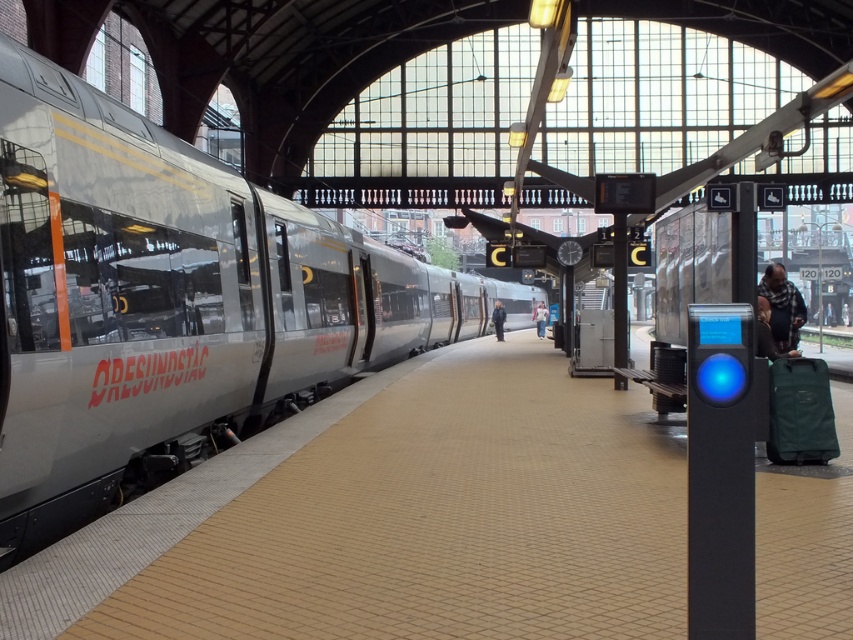
Question: Does silver metallic train at left have a larger size compared to plaid fabric scarf at right?

Choices:
 (A) no
 (B) yes

Answer: (B)

Question: Considering the real-world distances, which object is farthest from the dark blue shirt at right?

Choices:
 (A) dark blue jacket at center
 (B) light blue denim jacket at center
 (C) silver metallic train at left
 (D) plaid fabric scarf at right

Answer: (B)

Question: Estimate the real-world distances between objects in this image. Which object is closer to the dark blue shirt at right?

Choices:
 (A) light blue denim jacket at center
 (B) plaid fabric scarf at right
 (C) silver metallic train at left

Answer: (B)

Question: Does silver metallic train at left have a smaller size compared to dark blue shirt at right?

Choices:
 (A) no
 (B) yes

Answer: (A)

Question: Observing the image, what is the correct spatial positioning of silver metallic train at left in reference to light blue denim jacket at center?

Choices:
 (A) right
 (B) left

Answer: (B)

Question: Among these objects, which one is nearest to the camera?

Choices:
 (A) dark blue shirt at right
 (B) dark blue jacket at center
 (C) light blue denim jacket at center

Answer: (A)